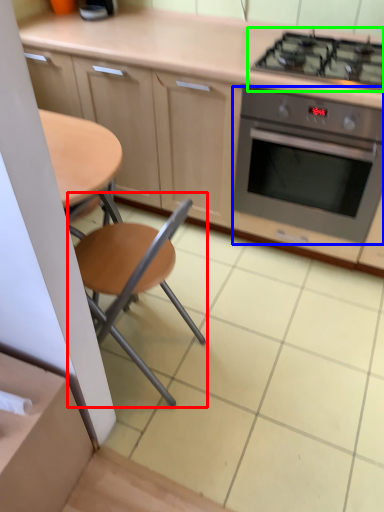
Question: Which object is positioned farthest from chair (highlighted by a red box)? Select from kitchen appliance (highlighted by a blue box) and gas stove (highlighted by a green box).

Choices:
 (A) kitchen appliance
 (B) gas stove

Answer: (B)